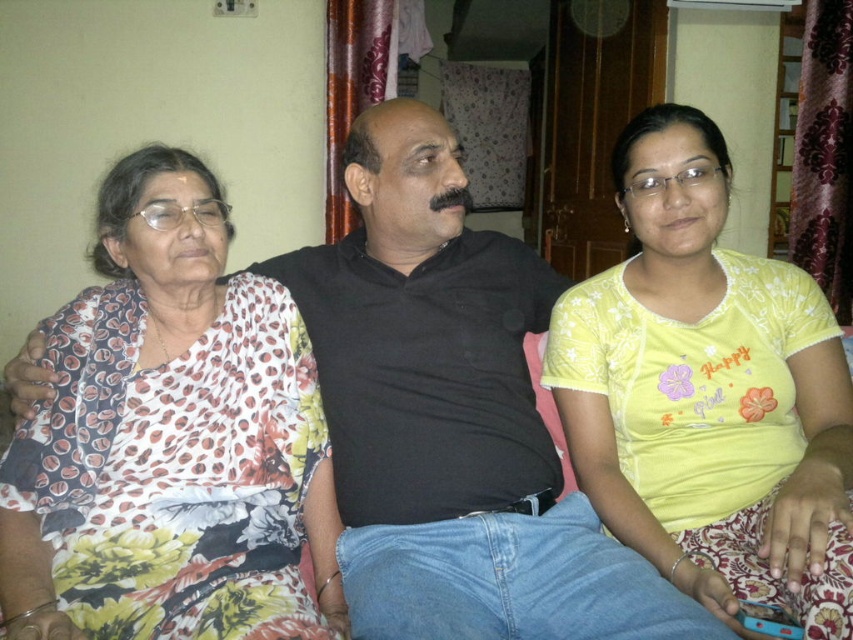
Is point (849, 476) closer to viewer compared to point (115, 493)?

Yes, it is.

Does point (589, 422) come behind point (184, 260)?

Yes, it is behind point (184, 260).

Locate an element on the screen. Image resolution: width=853 pixels, height=640 pixels. yellow printed t-shirt at center is located at coordinates (708, 392).